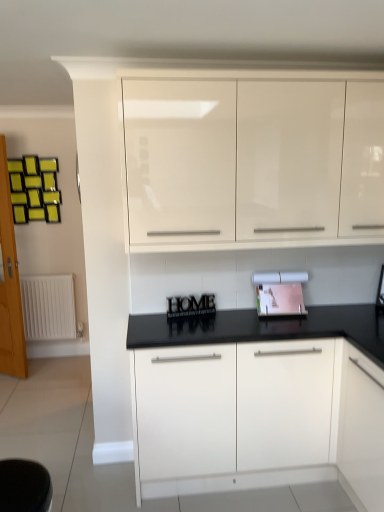
Question: Is white matte radiator at left inside the boundaries of wooden letters at center, or outside?

Choices:
 (A) outside
 (B) inside

Answer: (A)

Question: Is white matte radiator at left wider or thinner than wooden letters at center?

Choices:
 (A) wide
 (B) thin

Answer: (A)

Question: Based on their relative distances, which object is nearer to the matte pink paper at center?

Choices:
 (A) white glossy cabinet at center, the first cabinetry from the bottom
 (B) wooden letters at center
 (C) glossy white cabinets at upper center, the first cabinetry in the top-to-bottom sequence
 (D) wooden glass door at left
 (E) white matte radiator at left

Answer: (B)

Question: Which is farther from the wooden letters at center?

Choices:
 (A) white glossy cabinet at center, which appears as the 2th cabinetry when viewed from the top
 (B) wooden glass door at left
 (C) matte pink paper at center
 (D) white matte radiator at left
 (E) glossy white cabinets at upper center, the first cabinetry in the top-to-bottom sequence

Answer: (D)